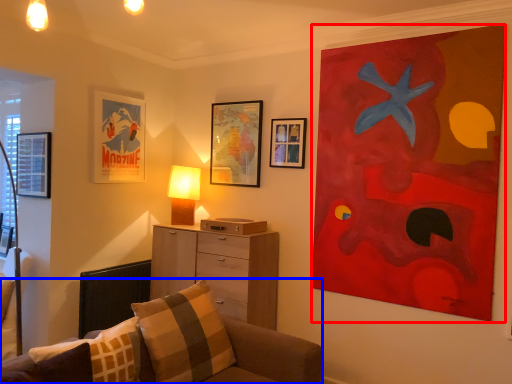
Question: Which object appears farthest to the camera in this image, picture frame (highlighted by a red box) or studio couch (highlighted by a blue box)?

Choices:
 (A) picture frame
 (B) studio couch

Answer: (A)